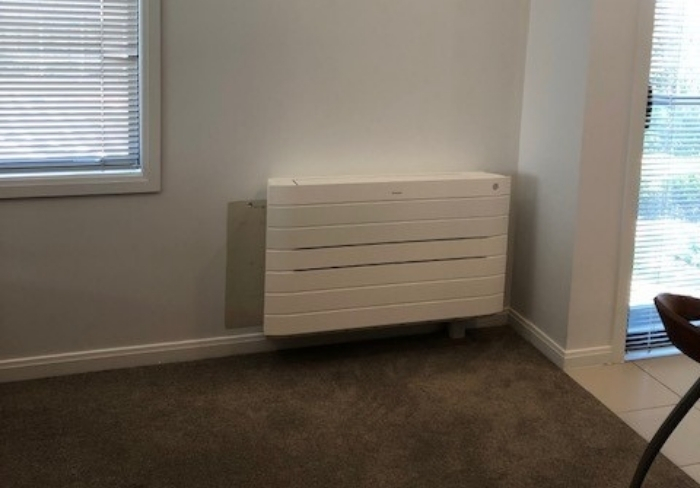
Identify the location of partially cropped furniture (possibly chair). Image resolution: width=700 pixels, height=488 pixels. (670, 319).